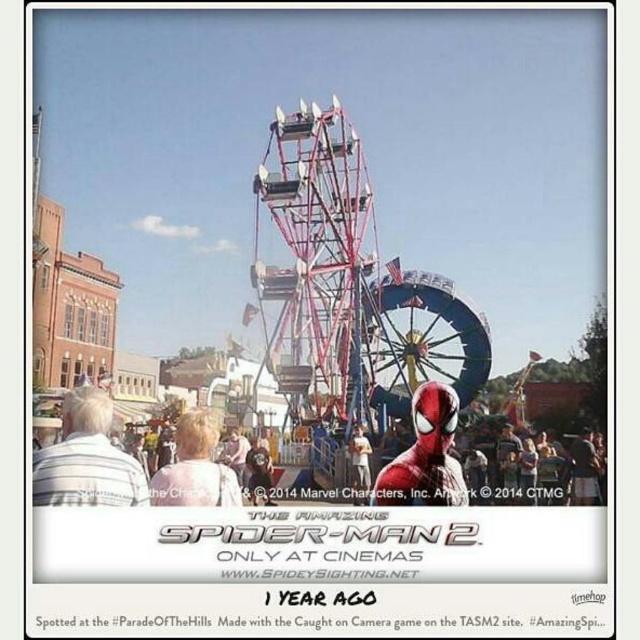
Question: Which point is farther from the camera taking this photo?

Choices:
 (A) (593, 451)
 (B) (307, 298)
 (C) (49, 497)
 (D) (388, 362)

Answer: (D)

Question: Estimate the real-world distances between objects in this image. Which object is farther from the metallic red ferris wheel at center?

Choices:
 (A) white striped shirt at lower left
 (B) matte red costume at center

Answer: (A)

Question: In this image, where is metallic red ferris wheel at center located relative to white striped shirt at lower left?

Choices:
 (A) below
 (B) above

Answer: (B)

Question: Is metallic red ferris wheel at center further to the viewer compared to matte red costume at center?

Choices:
 (A) yes
 (B) no

Answer: (A)

Question: Estimate the real-world distances between objects in this image. Which object is farther from the metallic red ferris wheel at center?

Choices:
 (A) white striped shirt at lower left
 (B) matte red costume at center
 (C) metallic ferris wheel at center

Answer: (A)

Question: Does metallic red ferris wheel at center appear on the left side of white striped shirt at lower left?

Choices:
 (A) no
 (B) yes

Answer: (A)